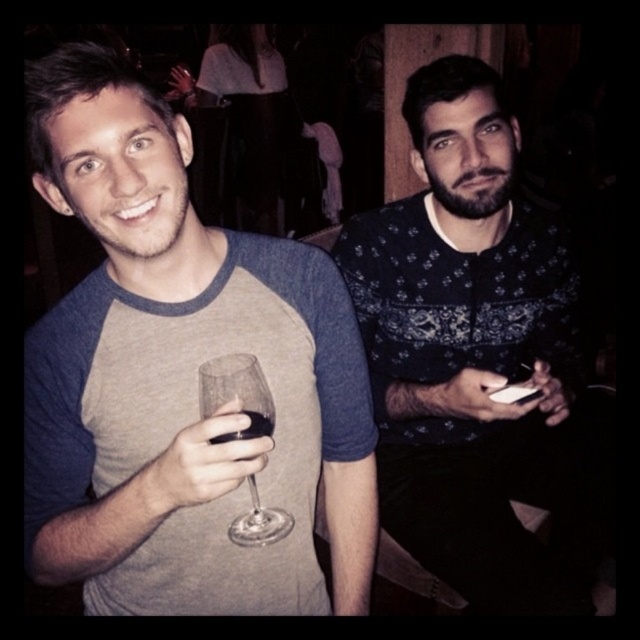
Question: Which of these objects is positioned closest to the clear glass wine at center?

Choices:
 (A) white matte phone at center
 (B) transparent glass at center
 (C) transparent glass at left

Answer: (B)

Question: Which of the following is the farthest from the observer?

Choices:
 (A) transparent glass at left
 (B) matte black phone at right
 (C) gray cotton t-shirt at center
 (D) floral-patterned sweater at center

Answer: (D)

Question: From the image, what is the correct spatial relationship of matte black phone at right in relation to clear glass wine at center?

Choices:
 (A) below
 (B) above

Answer: (A)

Question: Is transparent glass at left smaller than white matte phone at center?

Choices:
 (A) no
 (B) yes

Answer: (B)

Question: Which object is farther from the camera taking this photo?

Choices:
 (A) clear glass wine at center
 (B) gray cotton t-shirt at center
 (C) transparent glass at left
 (D) white matte phone at center

Answer: (D)

Question: Does transparent glass at center come in front of clear glass wine at center?

Choices:
 (A) yes
 (B) no

Answer: (A)